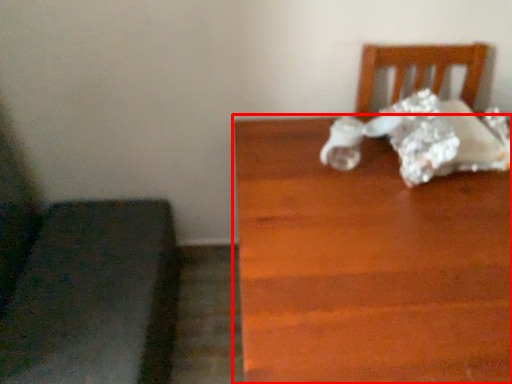
Question: Observing the image, what is the correct spatial positioning of table (annotated by the red box) in reference to furniture?

Choices:
 (A) right
 (B) left

Answer: (A)